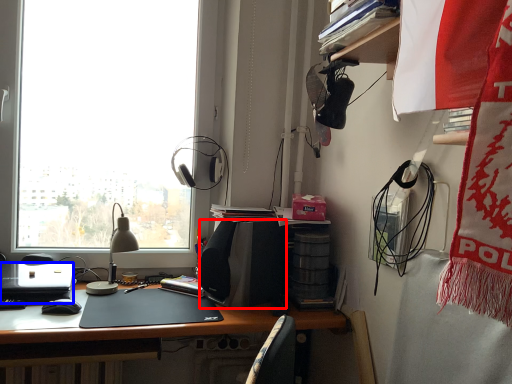
Question: Which of the following is the closest to the observer, loudspeaker (highlighted by a red box) or laptop (highlighted by a blue box)?

Choices:
 (A) loudspeaker
 (B) laptop

Answer: (B)